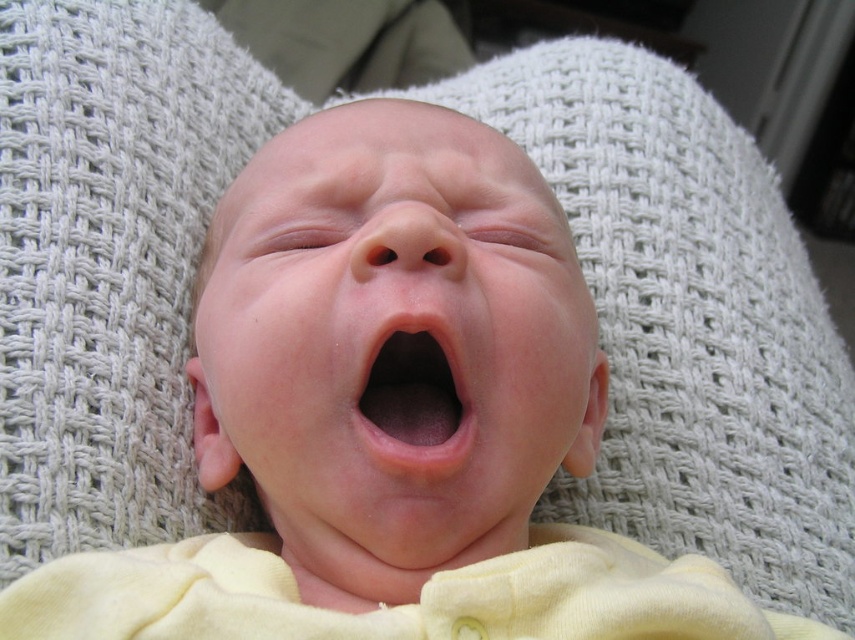
Does smooth skin face at center come in front of pink smooth flesh at center?

Yes, it is.

Can you confirm if smooth skin face at center is positioned above pink smooth flesh at center?

Yes.

This screenshot has width=855, height=640. What do you see at coordinates (393, 340) in the screenshot? I see `smooth skin face at center` at bounding box center [393, 340].

Where is `smooth skin face at center`? smooth skin face at center is located at coordinates [x=393, y=340].